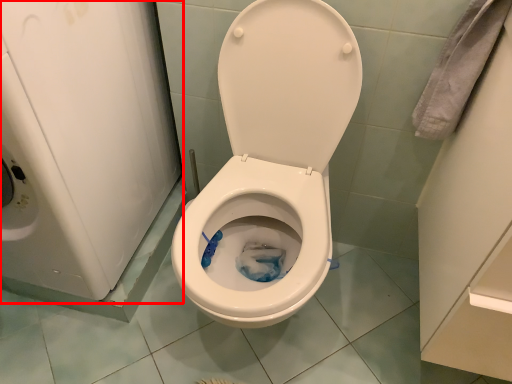
Question: From the image's perspective, considering the relative positions of appliance (annotated by the red box) and toilet in the image provided, where is appliance (annotated by the red box) located with respect to the staircase?

Choices:
 (A) above
 (B) below

Answer: (A)